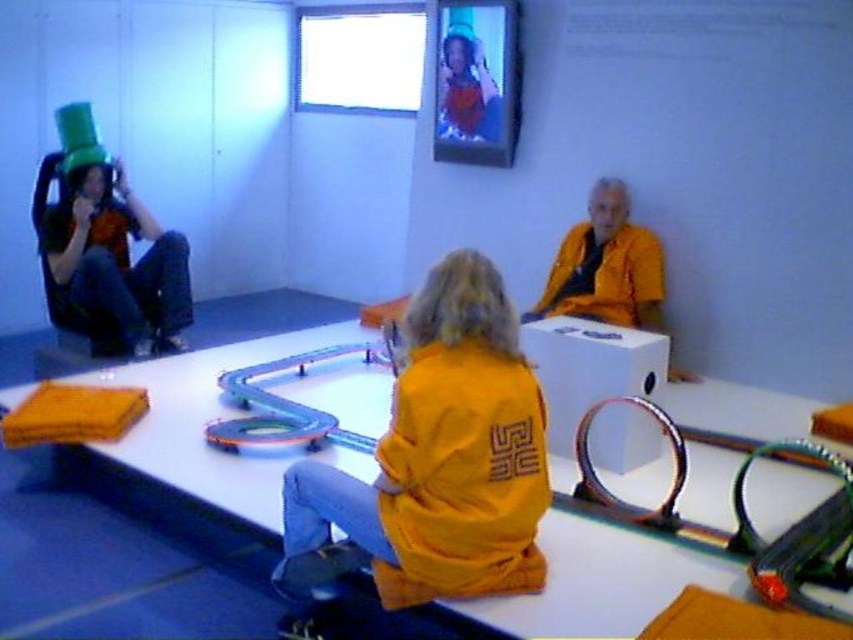
Between white glossy table at center and yellow matte jacket at center, which one has less height?

With less height is white glossy table at center.

Who is higher up, white glossy table at center or yellow matte jacket at center?

white glossy table at center is higher up.

The width and height of the screenshot is (853, 640). What do you see at coordinates (204, 424) in the screenshot? I see `white glossy table at center` at bounding box center [204, 424].

The image size is (853, 640). In order to click on white glossy table at center in this screenshot , I will do `click(204, 424)`.

Does yellow matte jacket at center have a larger size compared to matte black robe at left?

No, yellow matte jacket at center is not bigger than matte black robe at left.

Between point (401, 404) and point (78, 259), which one is positioned in front?

Point (401, 404) is in front.

Identify the location of yellow matte jacket at center. (445, 584).

Does white glossy table at center have a greater width compared to matte green hat at upper left?

Yes.

Is white glossy table at center to the left of matte green hat at upper left from the viewer's perspective?

Indeed, white glossy table at center is positioned on the left side of matte green hat at upper left.

Is point (700, 410) positioned after point (440, 106)?

No, it is in front of (440, 106).

The height and width of the screenshot is (640, 853). Identify the location of white glossy table at center. (204, 424).